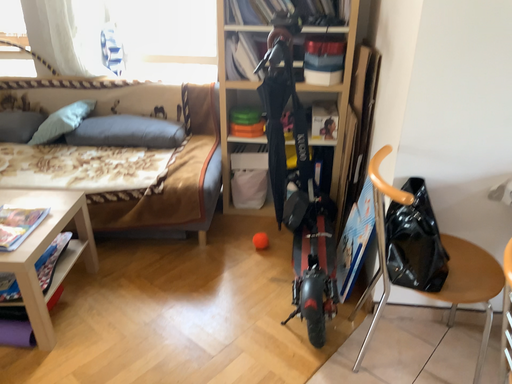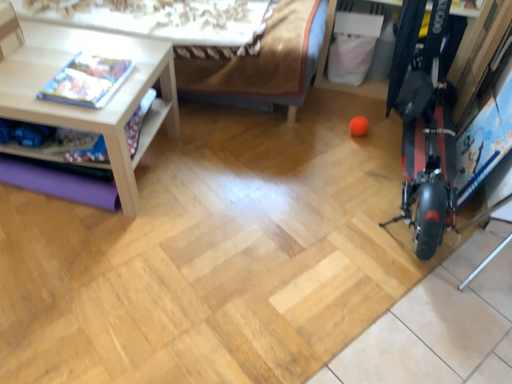
Question: How did the camera likely rotate when shooting the video?

Choices:
 (A) rotated downward
 (B) rotated upward

Answer: (A)